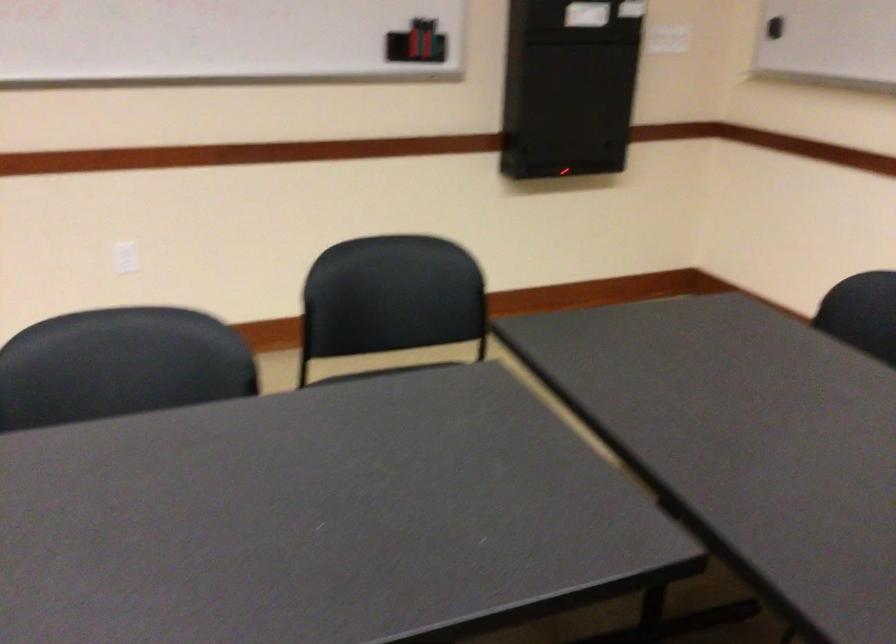
The height and width of the screenshot is (644, 896). I want to click on black chair sitting surface, so click(373, 303).